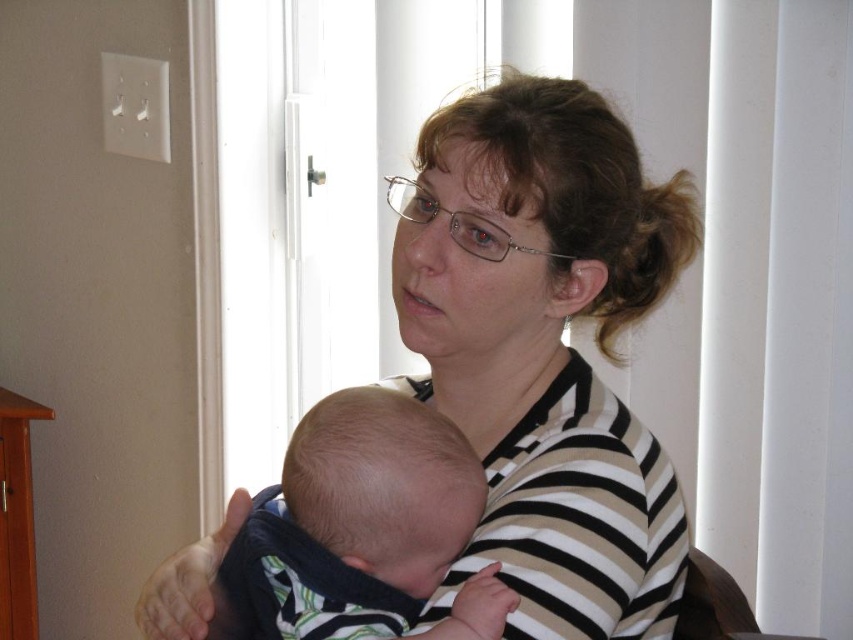
Between striped fabric woman at center and soft white baby at center, which one is positioned higher?

striped fabric woman at center is above.

Identify the location of striped fabric woman at center. (547, 348).

Is point (561, 280) positioned in front of point (389, 588)?

No.

Where is `striped fabric woman at center`? The height and width of the screenshot is (640, 853). striped fabric woman at center is located at coordinates (547, 348).